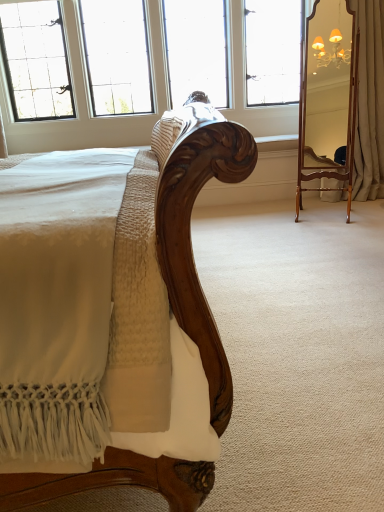
Identify the location of clear glass window at upper center. 81,58.

Which of these two, clear glass window at upper center or beige fabric curtain at right, is thinner?

beige fabric curtain at right.

From the image's perspective, is clear glass window at upper center positioned above or below beige fabric curtain at right?

clear glass window at upper center is situated higher than beige fabric curtain at right in the image.

Does clear glass window at upper center have a greater height compared to beige fabric curtain at right?

Incorrect, the height of clear glass window at upper center is not larger of that of beige fabric curtain at right.

Considering the relative positions of clear glass window at upper center and beige fabric curtain at right in the image provided, is clear glass window at upper center behind beige fabric curtain at right?

Yes, clear glass window at upper center is behind beige fabric curtain at right.

Between beige fabric curtain at right and wooden mirror at right, which one has larger size?

With larger size is wooden mirror at right.

How many degrees apart are the facing directions of beige fabric curtain at right and wooden mirror at right?

64.4 degrees separate the facing orientations of beige fabric curtain at right and wooden mirror at right.

Can you confirm if beige fabric curtain at right is thinner than wooden mirror at right?

No.

Would you consider beige fabric curtain at right to be distant from wooden mirror at right?

beige fabric curtain at right is actually quite close to wooden mirror at right.

Looking at this image, from the image's perspective, is wooden mirror at right above clear glass window at upper center?

Incorrect, from the image's perspective, wooden mirror at right is lower than clear glass window at upper center.

Considering the positions of point (315, 56) and point (168, 9), is point (315, 56) closer or farther from the camera than point (168, 9)?

Clearly, point (315, 56) is closer to the camera than point (168, 9).

Which object is wider, wooden mirror at right or clear glass window at upper center?

Wider between the two is clear glass window at upper center.

Does point (307, 115) come closer to viewer compared to point (377, 106)?

No, (307, 115) is behind (377, 106).

Does wooden mirror at right turn towards beige fabric curtain at right?

No, wooden mirror at right does not turn towards beige fabric curtain at right.

Identify the location of mirror in front of the beige fabric curtain at right. The width and height of the screenshot is (384, 512). (328, 96).

Between wooden mirror at right and beige fabric curtain at right, which one has less height?

With less height is wooden mirror at right.

What's the angular difference between clear glass window at upper center and wooden mirror at right's facing directions?

There is a 25.1-degree angle between the facing directions of clear glass window at upper center and wooden mirror at right.

Is clear glass window at upper center positioned beyond the bounds of wooden mirror at right?

Indeed, clear glass window at upper center is completely outside wooden mirror at right.

From the picture: Considering the sizes of clear glass window at upper center and wooden mirror at right in the image, is clear glass window at upper center bigger or smaller than wooden mirror at right?

In the image, clear glass window at upper center appears to be larger than wooden mirror at right.

Looking at this image, from the image's perspective, relative to wooden mirror at right, is clear glass window at upper center above or below?

From the image's perspective, clear glass window at upper center appears above wooden mirror at right.

Is beige fabric curtain at right at the right side of clear glass window at upper center?

Yes.

How far apart are beige fabric curtain at right and clear glass window at upper center?

1.58 meters.

Based on the photo, who is smaller, beige fabric curtain at right or clear glass window at upper center?

Smaller between the two is beige fabric curtain at right.

Identify the location of window on the left of beige fabric curtain at right. (x=81, y=58).

You are a GUI agent. You are given a task and a screenshot of the screen. Output one action in this format:
    pyautogui.click(x=<x>, y=<y>)
    Task: Click on the window above the beige fabric curtain at right (from the image's perspective)
    
    Given the screenshot: What is the action you would take?
    81,58

Image resolution: width=384 pixels, height=512 pixels. There is a wooden mirror at right. Find the location of `curtain above it (from a real-world perspective)`. curtain above it (from a real-world perspective) is located at coordinates (369, 102).

From the image, which object appears to be nearer to wooden mirror at right, beige fabric curtain at right or clear glass window at upper center?

beige fabric curtain at right lies closer to wooden mirror at right than the other object.

From the image, which object appears to be nearer to beige fabric curtain at right, wooden mirror at right or clear glass window at upper center?

The object closer to beige fabric curtain at right is wooden mirror at right.

Which object lies further to the anchor point clear glass window at upper center, wooden mirror at right or beige fabric curtain at right?

beige fabric curtain at right lies further to clear glass window at upper center than the other object.

Looking at the image, which one is located further to wooden mirror at right, clear glass window at upper center or beige fabric curtain at right?

clear glass window at upper center is positioned further to the anchor wooden mirror at right.

Estimate the real-world distances between objects in this image. Which object is closer to beige fabric curtain at right, clear glass window at upper center or wooden mirror at right?

Among the two, wooden mirror at right is located nearer to beige fabric curtain at right.

Looking at the image, which one is located closer to clear glass window at upper center, beige fabric curtain at right or wooden mirror at right?

Based on the image, wooden mirror at right appears to be nearer to clear glass window at upper center.

The width and height of the screenshot is (384, 512). Find the location of `mirror situated between clear glass window at upper center and beige fabric curtain at right from left to right`. mirror situated between clear glass window at upper center and beige fabric curtain at right from left to right is located at coordinates (328, 96).